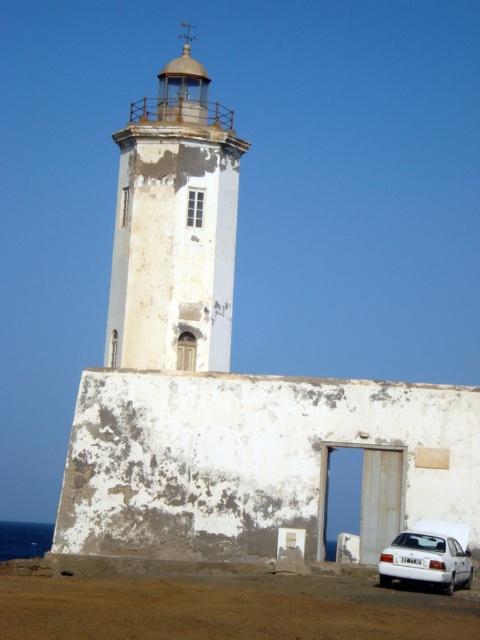
Question: Can you confirm if white weathered tower at center is positioned below white matte car at lower right?

Choices:
 (A) yes
 (B) no

Answer: (B)

Question: Among these points, which one is nearest to the camera?

Choices:
 (A) (187, 230)
 (B) (448, 579)

Answer: (B)

Question: Which of the following is the farthest from the observer?

Choices:
 (A) (409, 577)
 (B) (165, 284)

Answer: (B)

Question: Does white weathered tower at center have a lesser width compared to white matte car at lower right?

Choices:
 (A) no
 (B) yes

Answer: (A)

Question: Can you confirm if white weathered tower at center is bigger than white matte car at lower right?

Choices:
 (A) no
 (B) yes

Answer: (B)